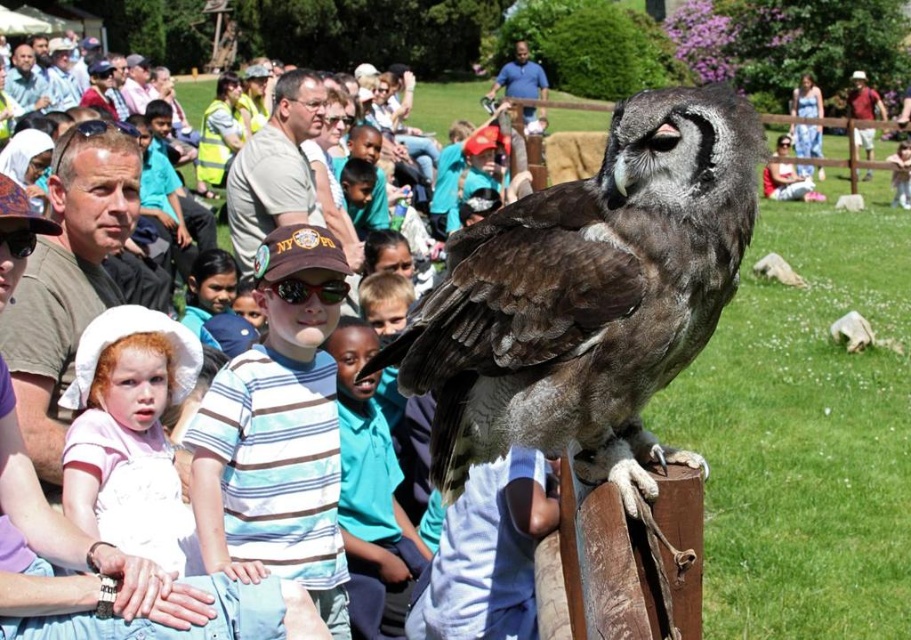
Question: Is the position of dark brown feathers at center more distant than that of blue striped shirt at center?

Choices:
 (A) yes
 (B) no

Answer: (B)

Question: Where is striped cotton shirt at center located in relation to blue striped shirt at center in the image?

Choices:
 (A) above
 (B) below

Answer: (A)

Question: Can you confirm if dark brown feathers at center is wider than blue striped shirt at center?

Choices:
 (A) no
 (B) yes

Answer: (B)

Question: Which object is farther from the camera taking this photo?

Choices:
 (A) dark brown feathers at center
 (B) blue striped shirt at center

Answer: (B)

Question: Which point appears farthest from the camera in this image?

Choices:
 (A) (364, 476)
 (B) (299, 538)

Answer: (A)

Question: Which of the following is the closest to the observer?

Choices:
 (A) dark brown feathers at center
 (B) blue striped shirt at center
 (C) striped cotton shirt at center

Answer: (A)